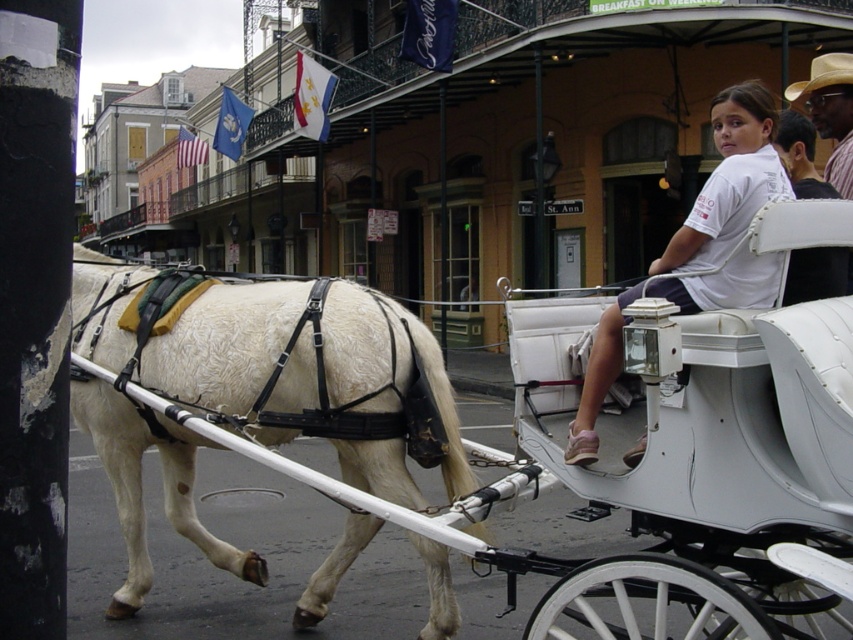
Question: Which point is closer to the camera?

Choices:
 (A) white leather horse cart at center
 (B) tan straw hat at upper right
 (C) white textured horse at left
 (D) white cotton shirt at upper right

Answer: (A)

Question: Is white cotton shirt at upper right in front of tan straw hat at upper right?

Choices:
 (A) no
 (B) yes

Answer: (B)

Question: Is white cotton shirt at upper right positioned before tan straw hat at upper right?

Choices:
 (A) yes
 (B) no

Answer: (A)

Question: Among these objects, which one is farthest from the camera?

Choices:
 (A) white leather horse cart at center
 (B) white cotton shirt at upper right
 (C) white textured horse at left
 (D) tan straw hat at upper right

Answer: (D)

Question: Which point appears closest to the camera in this image?

Choices:
 (A) (485, 536)
 (B) (727, 122)
 (C) (302, 301)

Answer: (B)

Question: Can you confirm if white leather horse cart at center is positioned to the right of tan straw hat at upper right?

Choices:
 (A) yes
 (B) no

Answer: (B)